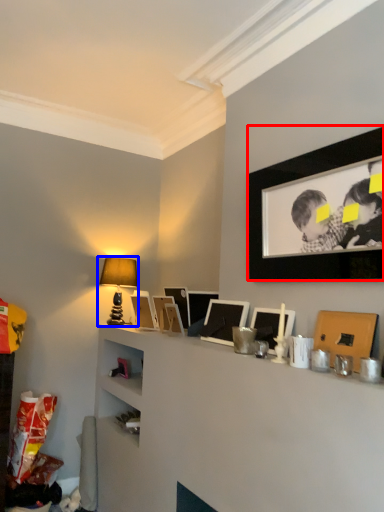
Question: Among these objects, which one is farthest to the camera, picture frame (highlighted by a red box) or table lamp (highlighted by a blue box)?

Choices:
 (A) picture frame
 (B) table lamp

Answer: (B)